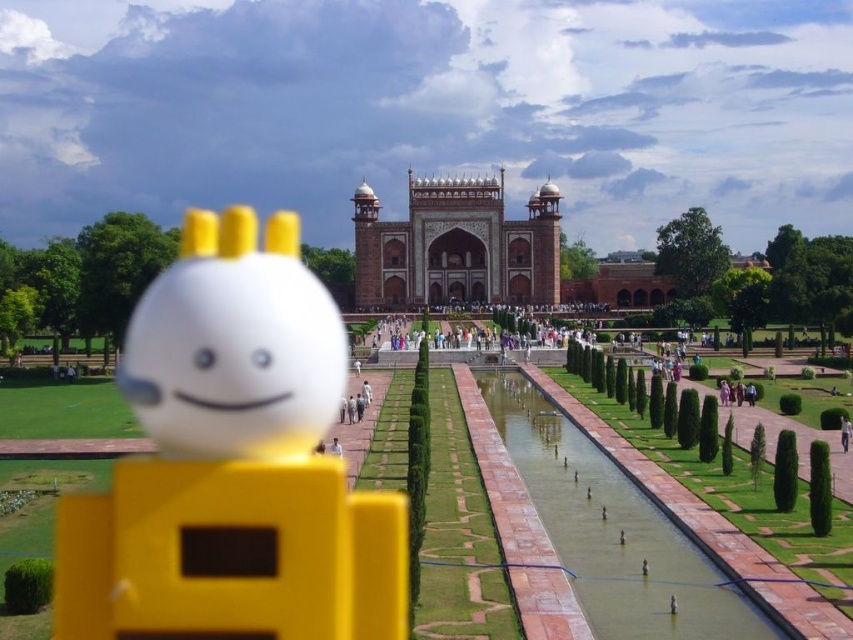
You are a tour guide leading a group to the Taj Mahal. You have a yellow matte toy at center and a white matte face at center in your hand. Your group asks if they can place both items on the lawn without them being too far apart. The park requires that any placed items must be within 10 feet of each other. Can they place them according to the rules?

The distance between the yellow matte toy at center and the white matte face at center is 9.81 feet. Since 9.81 feet is less than 10 feet, they can place them according to the park rules.

You are a tourist visiting the marble taj mahal at center and see the white matte person at center nearby. Which object is bigger in size?

The marble taj mahal at center is larger in size compared to the white matte person at center.

You are a visitor at the Taj Mahal and notice a yellow matte toy at center and a white matte face at center in the foreground. Which object is positioned lower in the scene?

The yellow matte toy at center is located below the white matte face at center, so it is positioned lower in the scene.